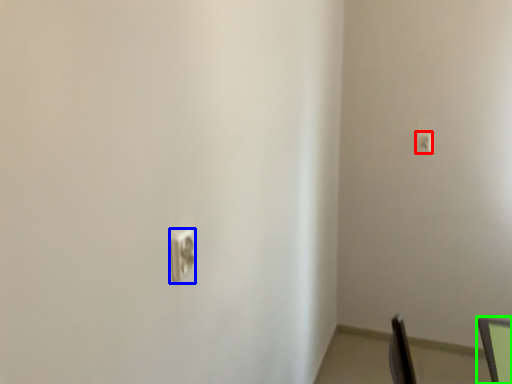
Question: Which object is positioned farthest from light switch (highlighted by a red box)? Select from light switch (highlighted by a blue box) and computer monitor (highlighted by a green box).

Choices:
 (A) light switch
 (B) computer monitor

Answer: (A)